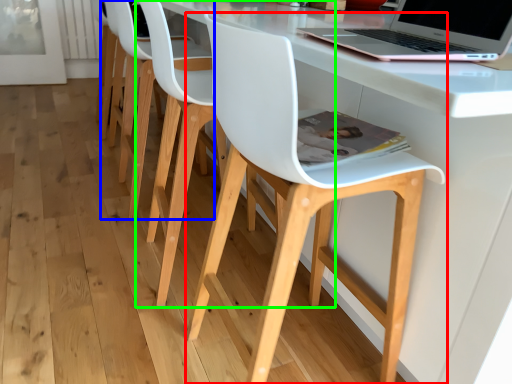
Question: Considering the real-world distances, which object is closest to chair (highlighted by a red box)? chair (highlighted by a blue box) or chair (highlighted by a green box).

Choices:
 (A) chair
 (B) chair

Answer: (B)